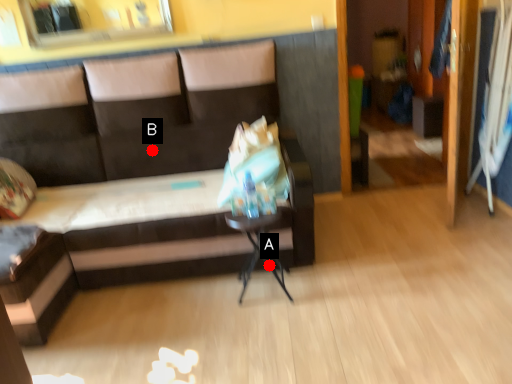
Question: Two points are circled on the image, labeled by A and B beside each circle. Among these points, which one is farthest from the camera?

Choices:
 (A) A is further
 (B) B is further

Answer: (B)